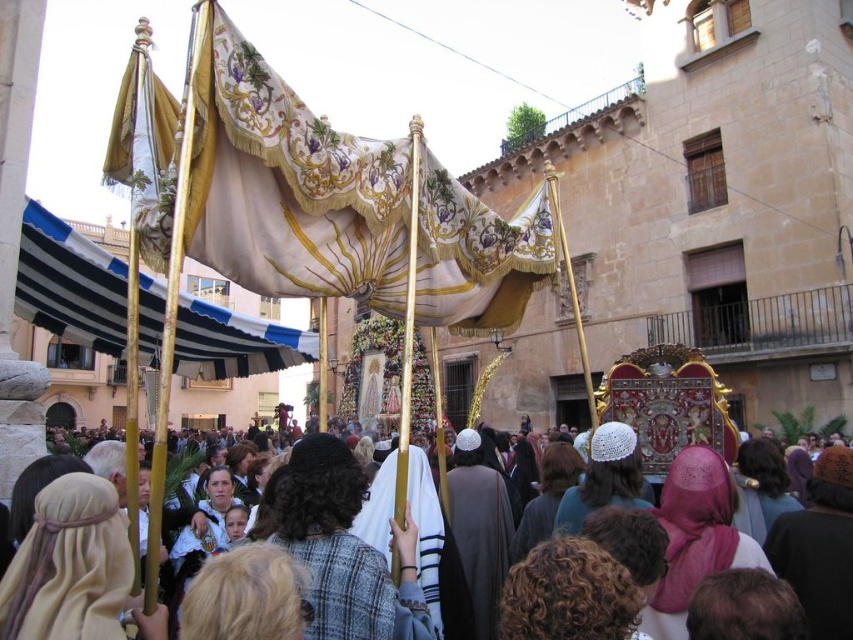
Based on the photo, you are a photographer trying to capture the blue and white striped fabric at left and the dark gray woolen robe at center in a single shot. Which object should you focus on first to ensure both are in focus?

You should focus on the dark gray woolen robe at center first because it is farther away than the blue and white striped fabric at left, ensuring both are in focus when using depth of field.

You are standing at the center of the street and want to locate the gold embroidered canopy at center. According to the coordinates provided, in which direction should you look to find it?

The gold embroidered canopy at center is located at coordinates point (289, 186), which is to the lower right from your current position at the center of the street.

You are a photographer trying to capture the gold embroidered flag at upper left and the dark gray woolen robe at center in a single shot. Based on their positions, which object appears taller in the image?

The gold embroidered flag at upper left appears taller than the dark gray woolen robe at center in the image because the gold embroidered flag at upper left has a greater height compared to dark gray woolen robe at center.